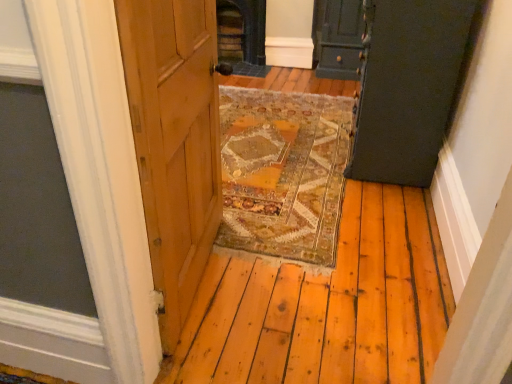
Describe the element at coordinates (243, 36) in the screenshot. I see `dark gray stone fireplace at center` at that location.

You are a GUI agent. You are given a task and a screenshot of the screen. Output one action in this format:
    pyautogui.click(x=<x>, y=<y>)
    Task: Click on the matte dark green cabinet at upper right, acting as the 1th door starting from the front
    
    Given the screenshot: What is the action you would take?
    (x=408, y=86)

Would you say dark green wood door at upper right, the 1th door when ordered from back to front, contains matte dark green cabinet at upper right, acting as the 1th door starting from the front?

No, matte dark green cabinet at upper right, acting as the 1th door starting from the front, is not surrounded by dark green wood door at upper right, the 1th door when ordered from back to front.

What's the angular difference between dark green wood door at upper right, acting as the second door starting from the front, and matte dark green cabinet at upper right, marked as the second door in a back-to-front arrangement,'s facing directions?

There is a 89.9-degree angle between the facing directions of dark green wood door at upper right, acting as the second door starting from the front, and matte dark green cabinet at upper right, marked as the second door in a back-to-front arrangement.

How much distance is there between dark green wood door at upper right, the 1th door when ordered from back to front, and matte dark green cabinet at upper right, marked as the second door in a back-to-front arrangement?

dark green wood door at upper right, the 1th door when ordered from back to front, is 6.73 feet away from matte dark green cabinet at upper right, marked as the second door in a back-to-front arrangement.

Is dark green wood door at upper right, acting as the second door starting from the front, turned away from matte dark green cabinet at upper right, marked as the second door in a back-to-front arrangement?

No, dark green wood door at upper right, acting as the second door starting from the front,'s orientation is not away from matte dark green cabinet at upper right, marked as the second door in a back-to-front arrangement.

Is dark gray stone fireplace at center oriented away from dark green wood door at upper right, the 1th door when ordered from back to front?

No, dark gray stone fireplace at center is not facing away from dark green wood door at upper right, the 1th door when ordered from back to front.

Considering the positions of points (232, 35) and (346, 55), is point (232, 35) farther from camera compared to point (346, 55)?

Yes.

Looking at this image, from a real-world perspective, relative to dark green wood door at upper right, the 1th door when ordered from back to front, is dark gray stone fireplace at center vertically above or below?

From a real-world perspective, dark gray stone fireplace at center is physically below dark green wood door at upper right, the 1th door when ordered from back to front.

From the image's perspective, does dark gray stone fireplace at center appear higher than dark green wood door at upper right, acting as the second door starting from the front?

Yes, from the image's perspective, dark gray stone fireplace at center is above dark green wood door at upper right, acting as the second door starting from the front.

Does dark green wood door at upper right, acting as the second door starting from the front, have a lesser height compared to dark gray stone fireplace at center?

No, dark green wood door at upper right, acting as the second door starting from the front, is not shorter than dark gray stone fireplace at center.

Is dark gray stone fireplace at center surrounded by dark green wood door at upper right, the 1th door when ordered from back to front?

No, dark gray stone fireplace at center is not a part of dark green wood door at upper right, the 1th door when ordered from back to front.

From the image's perspective, count 1st doors downward from the dark gray stone fireplace at center and point to it. Please provide its 2D coordinates.

[(337, 38)]

From a real-world perspective, between matte dark green cabinet at upper right, marked as the second door in a back-to-front arrangement, and dark green wood door at upper right, the 1th door when ordered from back to front, who is vertically higher?

In real-world perspective, matte dark green cabinet at upper right, marked as the second door in a back-to-front arrangement, is above.

Locate an element on the screen. door below the dark green wood door at upper right, the 1th door when ordered from back to front (from the image's perspective) is located at coordinates (408, 86).

Consider the image. Would you say matte dark green cabinet at upper right, marked as the second door in a back-to-front arrangement, is outside dark green wood door at upper right, acting as the second door starting from the front?

Absolutely, matte dark green cabinet at upper right, marked as the second door in a back-to-front arrangement, is external to dark green wood door at upper right, acting as the second door starting from the front.

Is matte dark green cabinet at upper right, acting as the 1th door starting from the front, looking in the opposite direction of dark green wood door at upper right, the 1th door when ordered from back to front?

No, dark green wood door at upper right, the 1th door when ordered from back to front, is not at the back of matte dark green cabinet at upper right, acting as the 1th door starting from the front.

From a real-world perspective, between matte dark green cabinet at upper right, marked as the second door in a back-to-front arrangement, and dark gray stone fireplace at center, who is vertically higher?

From a 3D spatial view, matte dark green cabinet at upper right, marked as the second door in a back-to-front arrangement, is above.

Between matte dark green cabinet at upper right, acting as the 1th door starting from the front, and dark gray stone fireplace at center, which one is positioned behind?

dark gray stone fireplace at center is further away from the camera.

Is matte dark green cabinet at upper right, marked as the second door in a back-to-front arrangement, looking in the opposite direction of dark gray stone fireplace at center?

No, matte dark green cabinet at upper right, marked as the second door in a back-to-front arrangement, is not facing away from dark gray stone fireplace at center.

What are the coordinates of `fireplace on the left of matte dark green cabinet at upper right, marked as the second door in a back-to-front arrangement` in the screenshot? It's located at [x=243, y=36].

From the picture: Based on their positions, is dark gray stone fireplace at center located to the left or right of matte dark green cabinet at upper right, acting as the 1th door starting from the front?

Based on their positions, dark gray stone fireplace at center is located to the left of matte dark green cabinet at upper right, acting as the 1th door starting from the front.

Does dark gray stone fireplace at center turn towards matte dark green cabinet at upper right, acting as the 1th door starting from the front?

No, dark gray stone fireplace at center is not aimed at matte dark green cabinet at upper right, acting as the 1th door starting from the front.

From a real-world perspective, does dark gray stone fireplace at center stand above matte dark green cabinet at upper right, marked as the second door in a back-to-front arrangement?

No.

Find the location of a particular element. The image size is (512, 384). door that appears in front of the dark green wood door at upper right, the 1th door when ordered from back to front is located at coordinates (408, 86).

Where is `fireplace behind the dark green wood door at upper right, the 1th door when ordered from back to front`? The image size is (512, 384). fireplace behind the dark green wood door at upper right, the 1th door when ordered from back to front is located at coordinates (243, 36).

When comparing their distances from matte dark green cabinet at upper right, marked as the second door in a back-to-front arrangement, does dark green wood door at upper right, the 1th door when ordered from back to front, or dark gray stone fireplace at center seem closer?

dark green wood door at upper right, the 1th door when ordered from back to front, lies closer to matte dark green cabinet at upper right, marked as the second door in a back-to-front arrangement, than the other object.

When comparing their distances from dark green wood door at upper right, acting as the second door starting from the front, does dark gray stone fireplace at center or matte dark green cabinet at upper right, acting as the 1th door starting from the front, seem further?

matte dark green cabinet at upper right, acting as the 1th door starting from the front.

Estimate the real-world distances between objects in this image. Which object is further from dark green wood door at upper right, the 1th door when ordered from back to front, matte dark green cabinet at upper right, acting as the 1th door starting from the front, or dark gray stone fireplace at center?

The object further to dark green wood door at upper right, the 1th door when ordered from back to front, is matte dark green cabinet at upper right, acting as the 1th door starting from the front.

Considering their positions, is matte dark green cabinet at upper right, acting as the 1th door starting from the front, positioned closer to dark gray stone fireplace at center than dark green wood door at upper right, acting as the second door starting from the front?

dark green wood door at upper right, acting as the second door starting from the front.

From the image, which object appears to be nearer to dark gray stone fireplace at center, dark green wood door at upper right, the 1th door when ordered from back to front, or matte dark green cabinet at upper right, acting as the 1th door starting from the front?

dark green wood door at upper right, the 1th door when ordered from back to front, is closer to dark gray stone fireplace at center.

From the image, which object appears to be farther from matte dark green cabinet at upper right, acting as the 1th door starting from the front, dark gray stone fireplace at center or dark green wood door at upper right, acting as the second door starting from the front?

Based on the image, dark gray stone fireplace at center appears to be further to matte dark green cabinet at upper right, acting as the 1th door starting from the front.

Where is `door located between matte dark green cabinet at upper right, marked as the second door in a back-to-front arrangement, and dark gray stone fireplace at center in the depth direction`? The width and height of the screenshot is (512, 384). door located between matte dark green cabinet at upper right, marked as the second door in a back-to-front arrangement, and dark gray stone fireplace at center in the depth direction is located at coordinates (337, 38).